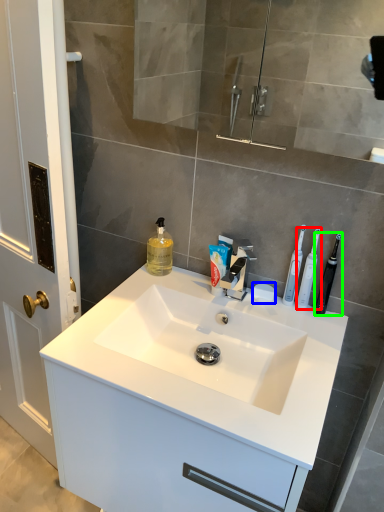
Question: Which is nearer to the toothbrush (highlighted by a red box)? soap (highlighted by a blue box) or toothbrush (highlighted by a green box).

Choices:
 (A) soap
 (B) toothbrush

Answer: (B)